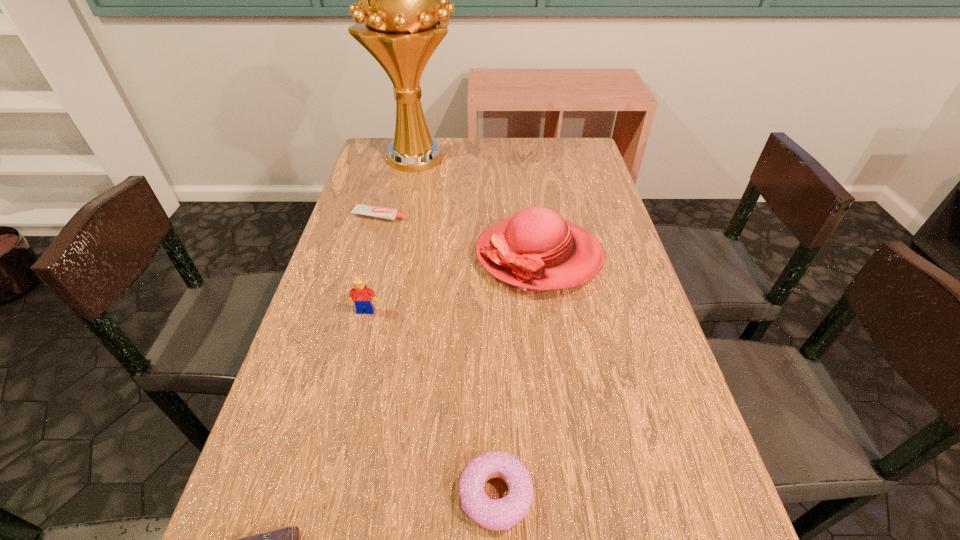
Where is `the tallest object`? The image size is (960, 540). the tallest object is located at coordinates point(402,15).

You are a GUI agent. You are given a task and a screenshot of the screen. Output one action in this format:
    pyautogui.click(x=<x>, y=<y>)
    Task: Click on the farthest object
    The image size is (960, 540).
    Given the screenshot: What is the action you would take?
    pyautogui.click(x=402, y=15)

Identify the location of the fifth shortest object. The width and height of the screenshot is (960, 540). click(x=536, y=250).

Where is `Lego`? The height and width of the screenshot is (540, 960). Lego is located at coordinates (360, 294).

Where is `the fourth farthest object`? This screenshot has height=540, width=960. the fourth farthest object is located at coordinates coord(360,294).

Identify the location of doughnut. (501, 514).

At what (x,y) coordinates should I click in order to perform the action: click on the fifth tallest object. Please return your answer as a coordinate pair (x, y). This screenshot has height=540, width=960. Looking at the image, I should click on (381, 212).

The image size is (960, 540). Find the location of `free location located 0.210m at the front of the tallest object where the globe is prominent`. free location located 0.210m at the front of the tallest object where the globe is prominent is located at coordinates (521, 157).

Where is `free point located 0.210m at the front of the second tallest object with a bow`? Image resolution: width=960 pixels, height=540 pixels. free point located 0.210m at the front of the second tallest object with a bow is located at coordinates (394, 255).

I want to click on vacant space located at the front of the second tallest object with a bow, so click(351, 255).